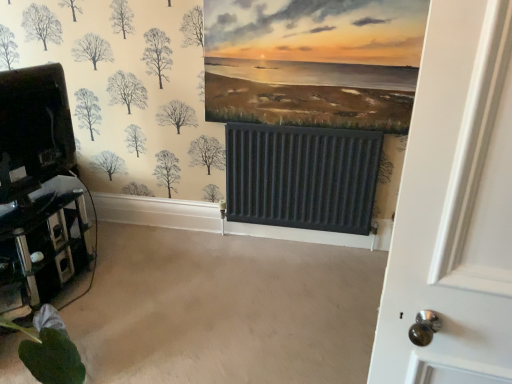
The image size is (512, 384). In order to click on matte black entertainment center at left in this screenshot , I will do `click(41, 195)`.

The height and width of the screenshot is (384, 512). Describe the element at coordinates (41, 195) in the screenshot. I see `matte black entertainment center at left` at that location.

The width and height of the screenshot is (512, 384). I want to click on matte black entertainment center at left, so click(x=41, y=195).